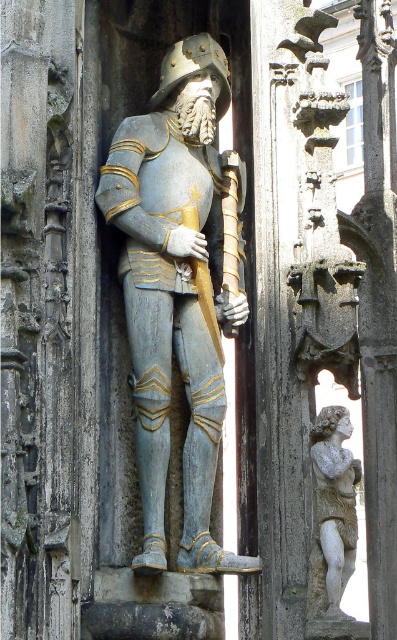
Who is positioned more to the left, matte blue armor at center or carved stone cherub at right?

matte blue armor at center

Is matte blue armor at center bigger than carved stone cherub at right?

Yes, matte blue armor at center is bigger than carved stone cherub at right.

Does point (109, 176) come closer to viewer compared to point (343, 588)?

No, it is not.

I want to click on matte blue armor at center, so click(175, 291).